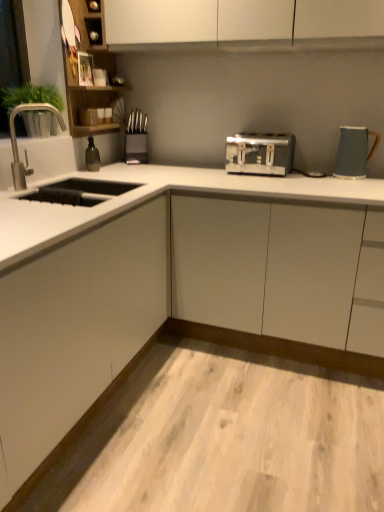
Question: Should I look upward or downward to see silver metallic faucet at left?

Choices:
 (A) up
 (B) down

Answer: (A)

Question: Is wooden cabinet at upper left surrounding green matte plant at left?

Choices:
 (A) yes
 (B) no

Answer: (B)

Question: Is wooden cabinet at upper left facing away from green matte plant at left?

Choices:
 (A) no
 (B) yes

Answer: (A)

Question: Can you confirm if wooden cabinet at upper left is shorter than green matte plant at left?

Choices:
 (A) yes
 (B) no

Answer: (B)

Question: Is wooden cabinet at upper left at the right side of green matte plant at left?

Choices:
 (A) no
 (B) yes

Answer: (B)

Question: From the image's perspective, does wooden cabinet at upper left appear lower than green matte plant at left?

Choices:
 (A) yes
 (B) no

Answer: (B)

Question: Is wooden cabinet at upper left smaller than green matte plant at left?

Choices:
 (A) yes
 (B) no

Answer: (B)

Question: Is green matte plant at left wider than white matte cabinet at lower left?

Choices:
 (A) yes
 (B) no

Answer: (B)

Question: Can you see green matte plant at left touching white matte cabinet at lower left?

Choices:
 (A) yes
 (B) no

Answer: (B)

Question: Can you confirm if green matte plant at left is thinner than white matte cabinet at lower left?

Choices:
 (A) no
 (B) yes

Answer: (B)

Question: From the image's perspective, is green matte plant at left beneath white matte cabinet at lower left?

Choices:
 (A) yes
 (B) no

Answer: (B)

Question: Is the depth of green matte plant at left less than that of white matte cabinet at lower left?

Choices:
 (A) no
 (B) yes

Answer: (A)

Question: Is green matte plant at left positioned with its back to white matte cabinet at lower left?

Choices:
 (A) no
 (B) yes

Answer: (A)

Question: Is metallic knife block at center closer to camera compared to white laminate countertop at lower center?

Choices:
 (A) yes
 (B) no

Answer: (B)